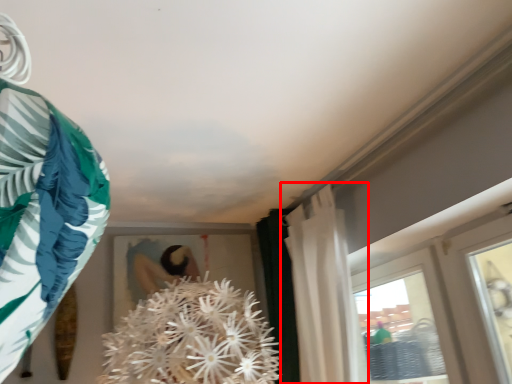
Question: Considering the relative positions of curtain (annotated by the red box) and clothing in the image provided, where is curtain (annotated by the red box) located with respect to the staircase?

Choices:
 (A) right
 (B) left

Answer: (A)